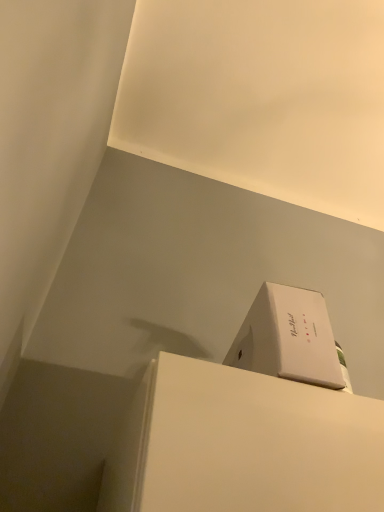
The width and height of the screenshot is (384, 512). Describe the element at coordinates (288, 338) in the screenshot. I see `white matte box at upper right` at that location.

Locate an element on the screen. white matte box at upper right is located at coordinates (288, 338).

In order to click on white matte box at upper right in this screenshot , I will do `click(288, 338)`.